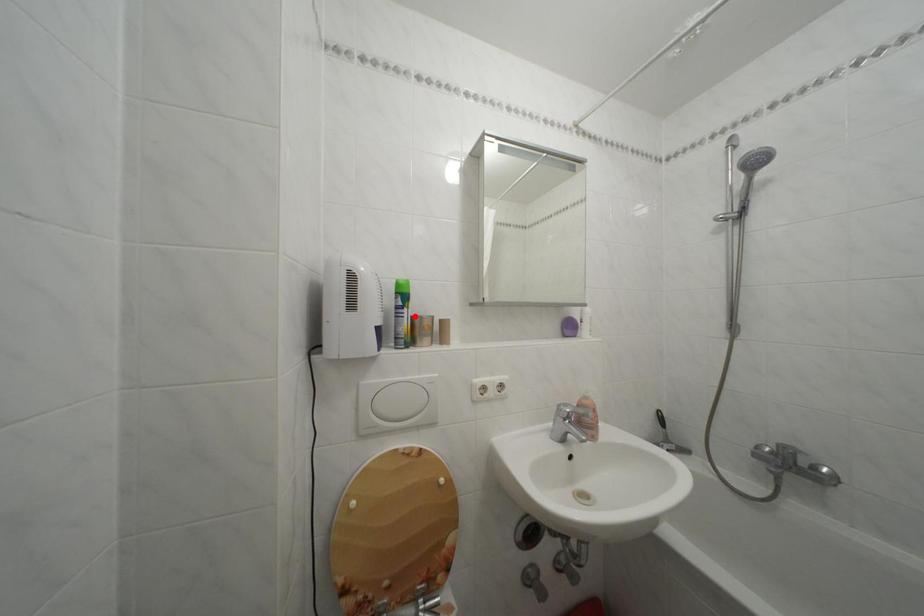
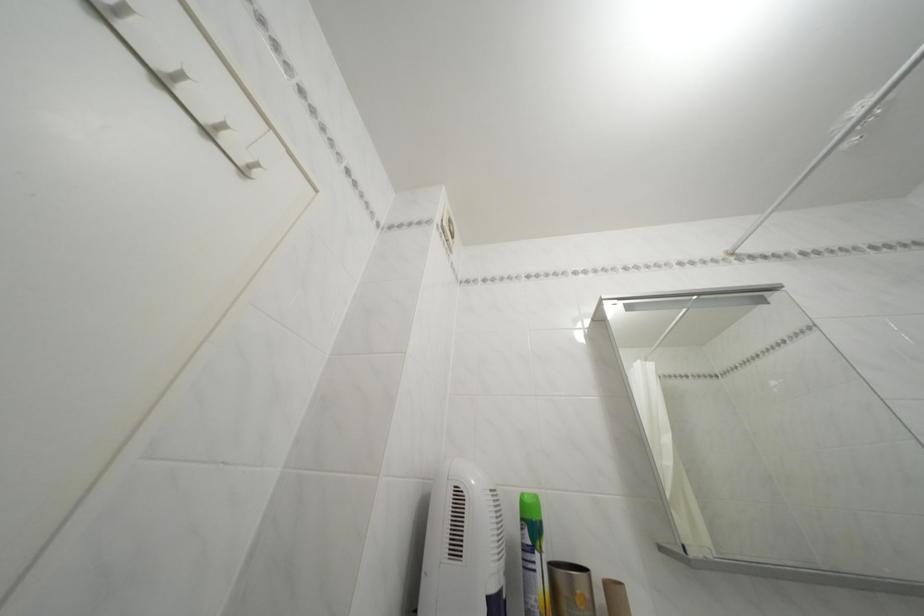
In the second image, find the point that corresponds to the highlighted location in the first image.

(545, 562)